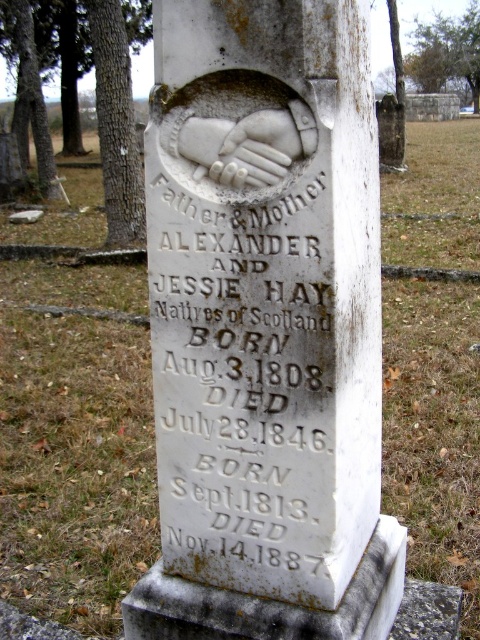
Question: Which object is closer to the camera taking this photo?

Choices:
 (A) white stone inscription at center
 (B) white marble hand at center
 (C) white marble gravestone at center

Answer: (C)

Question: Among these objects, which one is nearest to the camera?

Choices:
 (A) white marble gravestone at center
 (B) white marble hand at center
 (C) white stone inscription at center

Answer: (A)

Question: Is white marble gravestone at center smaller than white marble hand at center?

Choices:
 (A) yes
 (B) no

Answer: (B)

Question: Is white stone inscription at center above white marble hand at center?

Choices:
 (A) yes
 (B) no

Answer: (B)

Question: Does white marble gravestone at center have a larger size compared to white stone inscription at center?

Choices:
 (A) yes
 (B) no

Answer: (A)

Question: Considering the real-world distances, which object is closest to the white marble gravestone at center?

Choices:
 (A) white marble hand at center
 (B) white stone inscription at center

Answer: (B)